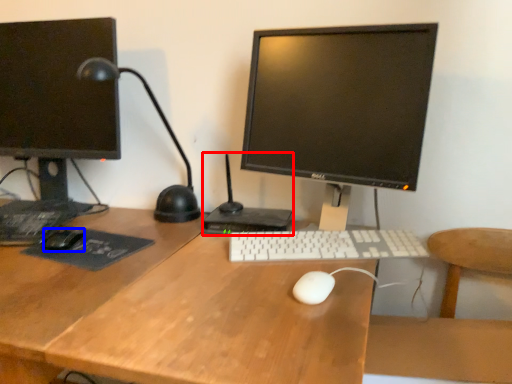
Question: Which object appears closest to the camera in this image, computer (highlighted by a red box) or mouse (highlighted by a blue box)?

Choices:
 (A) computer
 (B) mouse

Answer: (B)